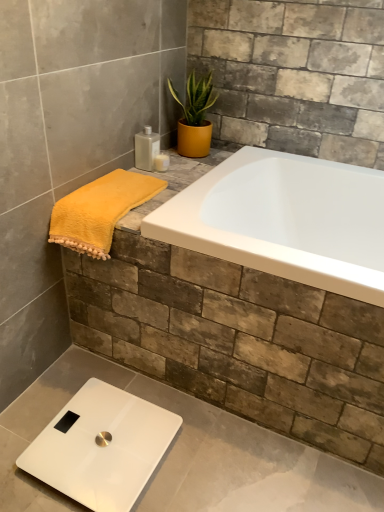
Question: From a real-world perspective, is matte yellow pot at upper center positioned under white glossy scale at lower left based on gravity?

Choices:
 (A) no
 (B) yes

Answer: (A)

Question: Can you confirm if matte yellow pot at upper center is wider than white glossy scale at lower left?

Choices:
 (A) yes
 (B) no

Answer: (B)

Question: Is matte yellow pot at upper center turned away from white glossy scale at lower left?

Choices:
 (A) no
 (B) yes

Answer: (A)

Question: Is matte yellow pot at upper center bigger than white glossy scale at lower left?

Choices:
 (A) no
 (B) yes

Answer: (B)

Question: Does matte yellow pot at upper center turn towards white glossy scale at lower left?

Choices:
 (A) yes
 (B) no

Answer: (B)

Question: Is matte yellow pot at upper center at the right side of white glossy scale at lower left?

Choices:
 (A) yes
 (B) no

Answer: (A)

Question: Is translucent plastic bottle at upper center, marked as the 2th toiletry in a right-to-left arrangement, taller than matte yellow pot at upper center?

Choices:
 (A) no
 (B) yes

Answer: (A)

Question: Can you confirm if translucent plastic bottle at upper center, marked as the 2th toiletry in a right-to-left arrangement, is positioned to the left of matte yellow pot at upper center?

Choices:
 (A) no
 (B) yes

Answer: (B)

Question: From the image's perspective, is translucent plastic bottle at upper center, marked as the 2th toiletry in a right-to-left arrangement, on top of matte yellow pot at upper center?

Choices:
 (A) yes
 (B) no

Answer: (B)

Question: Are translucent plastic bottle at upper center, marked as the 2th toiletry in a right-to-left arrangement, and matte yellow pot at upper center beside each other?

Choices:
 (A) no
 (B) yes

Answer: (A)

Question: Would you say translucent plastic bottle at upper center, marked as the 2th toiletry in a right-to-left arrangement, contains matte yellow pot at upper center?

Choices:
 (A) no
 (B) yes

Answer: (A)

Question: Is translucent plastic bottle at upper center, marked as the 2th toiletry in a right-to-left arrangement, facing away from matte yellow pot at upper center?

Choices:
 (A) no
 (B) yes

Answer: (A)

Question: From a real-world perspective, is white glossy scale at lower left physically above yellow fluffy towel at left?

Choices:
 (A) no
 (B) yes

Answer: (A)